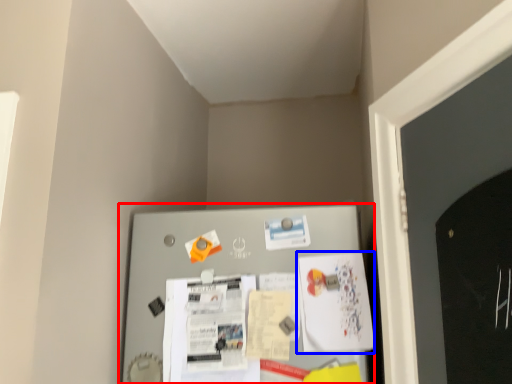
Question: Among these objects, which one is nearest to the camera, bulletin board (highlighted by a red box) or poster (highlighted by a blue box)?

Choices:
 (A) bulletin board
 (B) poster

Answer: (A)